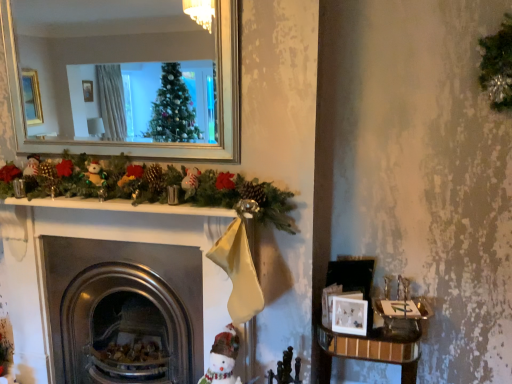
Image resolution: width=512 pixels, height=384 pixels. I want to click on white fabric snowman at lower center, so click(223, 358).

Identify the location of white matte picture frame at lower right. The width and height of the screenshot is (512, 384). (349, 315).

Describe the element at coordinates (349, 315) in the screenshot. I see `white matte picture frame at lower right` at that location.

Locate an element on the screen. wooden table at lower right is located at coordinates (372, 349).

This screenshot has height=384, width=512. Find the location of `white fabric snowman at lower center`. white fabric snowman at lower center is located at coordinates (223, 358).

Can you see metallic fireplace at center touching wooden table at lower right?

No, metallic fireplace at center is not in contact with wooden table at lower right.

Can you confirm if metallic fireplace at center is wider than wooden table at lower right?

Yes, metallic fireplace at center is wider than wooden table at lower right.

Is wooden table at lower right at the back of metallic fireplace at center?

No, metallic fireplace at center's orientation is not away from wooden table at lower right.

Are white matte picture frame at lower right and wooden table at lower right making contact?

No, white matte picture frame at lower right is not beside wooden table at lower right.

In terms of height, does white matte picture frame at lower right look taller or shorter compared to wooden table at lower right?

In the image, white matte picture frame at lower right appears to be shorter than wooden table at lower right.

Which is correct: white matte picture frame at lower right is inside wooden table at lower right, or outside of it?

white matte picture frame at lower right is not inside wooden table at lower right, it's outside.

Consider the image. What's the angular difference between white matte picture frame at lower right and wooden table at lower right's facing directions?

1.75 degrees separate the facing orientations of white matte picture frame at lower right and wooden table at lower right.

In the scene shown: Which object is thinner, white fabric snowman at lower center or metallic fireplace at center?

white fabric snowman at lower center is thinner.

Is white fabric snowman at lower center to the left of metallic fireplace at center from the viewer's perspective?

No, white fabric snowman at lower center is not to the left of metallic fireplace at center.

Is white fabric snowman at lower center oriented away from metallic fireplace at center?

No, white fabric snowman at lower center's orientation is not away from metallic fireplace at center.

Is white fabric snowman at lower center bigger than metallic fireplace at center?

Incorrect, white fabric snowman at lower center is not larger than metallic fireplace at center.

Locate an element on the screen. Image resolution: width=512 pixels, height=384 pixels. fireplace on the left of white fabric snowman at lower center is located at coordinates (127, 222).

Does point (213, 243) come in front of point (224, 379)?

That is True.

From the image's perspective, which is above, metallic fireplace at center or white fabric snowman at lower center?

metallic fireplace at center, from the image's perspective.

How much distance is there between white fabric snowman at lower center and white matte picture frame at lower right?

white fabric snowman at lower center is 21.31 inches away from white matte picture frame at lower right.

Is white fabric snowman at lower center facing away from white matte picture frame at lower right?

white fabric snowman at lower center does not have its back to white matte picture frame at lower right.

Considering the sizes of white fabric snowman at lower center and white matte picture frame at lower right in the image, is white fabric snowman at lower center taller or shorter than white matte picture frame at lower right?

white fabric snowman at lower center is taller than white matte picture frame at lower right.

From the image's perspective, is white fabric snowman at lower center located above or below white matte picture frame at lower right?

Based on their image positions, white fabric snowman at lower center is located beneath white matte picture frame at lower right.

Which of these two, white fabric snowman at lower center or wooden table at lower right, is thinner?

white fabric snowman at lower center is thinner.

From the image's perspective, is white fabric snowman at lower center below wooden table at lower right?

No.

Locate an element on the screen. table directly beneath the white fabric snowman at lower center (from a real-world perspective) is located at coordinates (372, 349).

From the picture: Does white fabric snowman at lower center come in front of wooden table at lower right?

Yes, white fabric snowman at lower center is closer to the camera.

Who is more distant, white matte picture frame at lower right or white fabric snowman at lower center?

white matte picture frame at lower right.

Does white matte picture frame at lower right appear on the left side of white fabric snowman at lower center?

In fact, white matte picture frame at lower right is to the right of white fabric snowman at lower center.

Is point (347, 298) positioned before point (226, 376)?

No, it is not.

Is white matte picture frame at lower right positioned far away from white fabric snowman at lower center?

No, white matte picture frame at lower right is in close proximity to white fabric snowman at lower center.

I want to click on fireplace positioned vertically above the wooden table at lower right (from a real-world perspective), so click(x=127, y=222).

At what (x,y) coordinates should I click in order to perform the action: click on table that appears in front of the white matte picture frame at lower right. Please return your answer as a coordinate pair (x, y). Looking at the image, I should click on (372, 349).

In the scene shown: Considering their positions, is white fabric snowman at lower center positioned closer to white matte picture frame at lower right than wooden table at lower right?

wooden table at lower right lies closer to white matte picture frame at lower right than the other object.

Based on their spatial positions, is white matte picture frame at lower right or wooden table at lower right further from white fabric snowman at lower center?

wooden table at lower right is further to white fabric snowman at lower center.

From the image, which object appears to be nearer to white matte picture frame at lower right, metallic fireplace at center or white fabric snowman at lower center?

white fabric snowman at lower center is closer to white matte picture frame at lower right.

Which object lies further to the anchor point wooden table at lower right, white matte picture frame at lower right or white fabric snowman at lower center?

white fabric snowman at lower center is further to wooden table at lower right.

Considering their positions, is white matte picture frame at lower right positioned further to wooden table at lower right than metallic fireplace at center?

metallic fireplace at center is positioned further to the anchor wooden table at lower right.

Estimate the real-world distances between objects in this image. Which object is closer to white fabric snowman at lower center, wooden table at lower right or metallic fireplace at center?

metallic fireplace at center.

Based on the photo, considering their positions, is white fabric snowman at lower center positioned closer to wooden table at lower right than white matte picture frame at lower right?

The object closer to wooden table at lower right is white matte picture frame at lower right.

Which object lies nearer to the anchor point wooden table at lower right, metallic fireplace at center or white matte picture frame at lower right?

Based on the image, white matte picture frame at lower right appears to be nearer to wooden table at lower right.

I want to click on picture frame between white fabric snowman at lower center and wooden table at lower right from left to right, so click(349, 315).

The image size is (512, 384). I want to click on toy between metallic fireplace at center and wooden table at lower right, so click(x=223, y=358).

In order to click on toy between metallic fireplace at center and white matte picture frame at lower right in this screenshot , I will do `click(223, 358)`.

Locate an element on the screen. picture frame between metallic fireplace at center and wooden table at lower right from left to right is located at coordinates (349, 315).